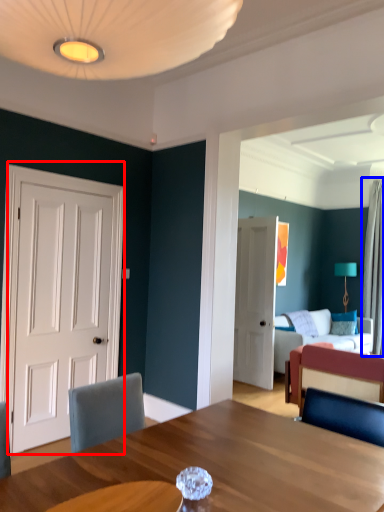
Question: Among these objects, which one is nearest to the camera, door (highlighted by a red box) or curtain (highlighted by a blue box)?

Choices:
 (A) door
 (B) curtain

Answer: (A)